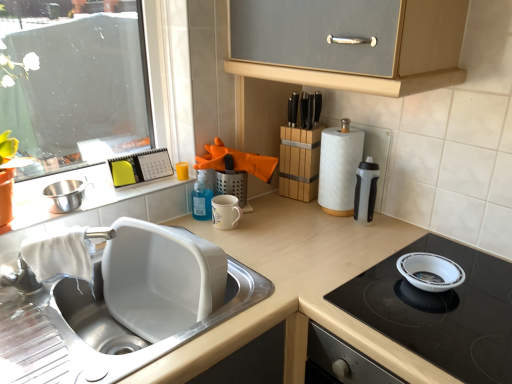
Identify the location of vacant area in front of white textured paper towel at right. coord(340,241).